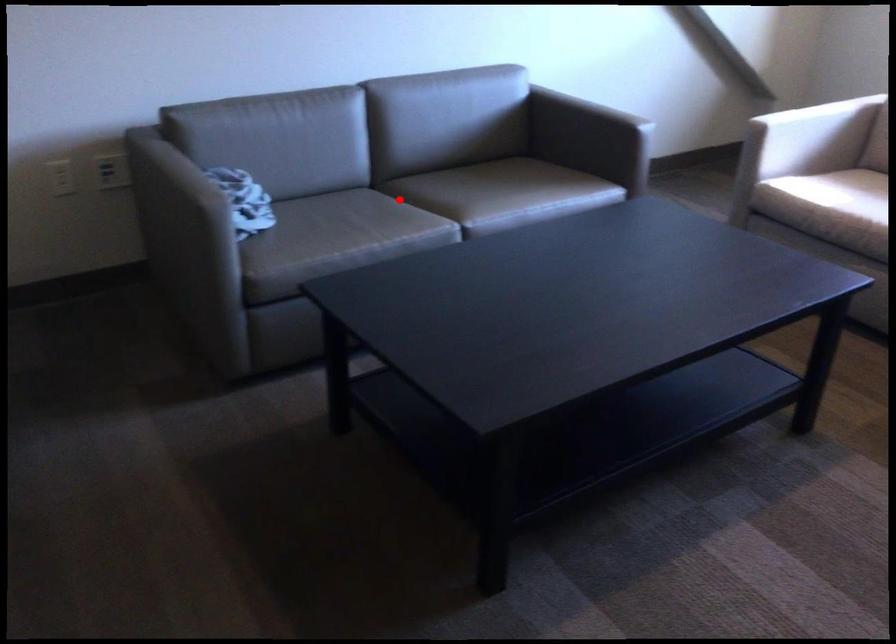
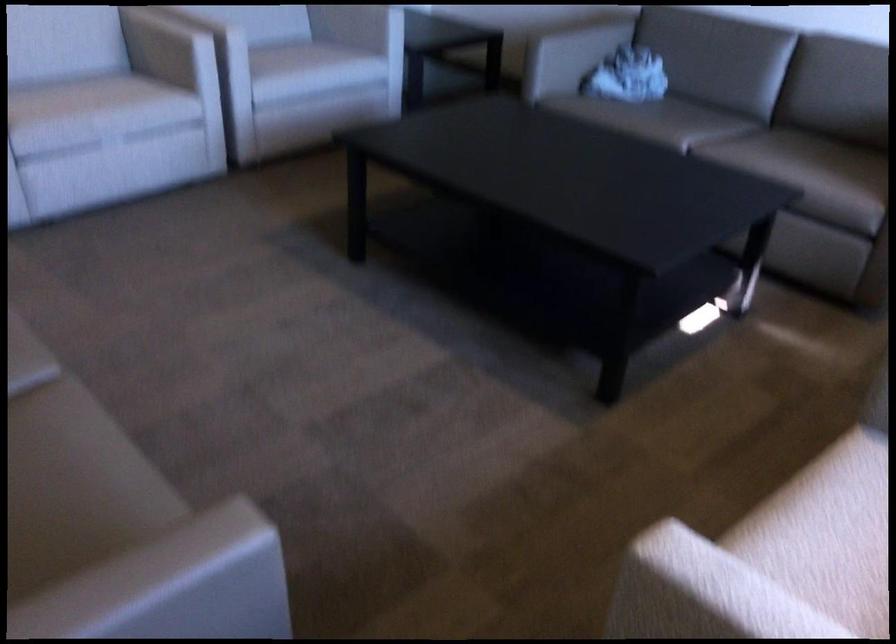
The point at the highlighted location is marked in the first image. Where is the corresponding point in the second image?

(714, 127)